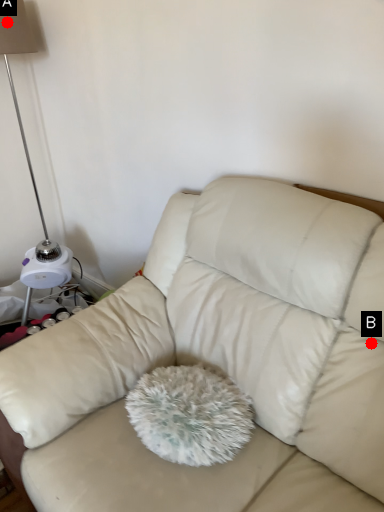
Question: Two points are circled on the image, labeled by A and B beside each circle. Which of the following is the closest to the observer?

Choices:
 (A) A is closer
 (B) B is closer

Answer: (B)